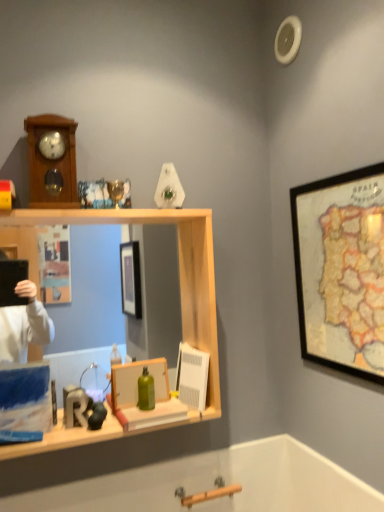
Question: Considering the relative sizes of wooden framed map at upper right, the first picture frame in the top-to-bottom sequence, and wooden clock at upper left in the image provided, is wooden framed map at upper right, the first picture frame in the top-to-bottom sequence, bigger than wooden clock at upper left?

Choices:
 (A) yes
 (B) no

Answer: (A)

Question: From a real-world perspective, is wooden framed map at upper right, placed as the 1th picture frame when sorted from right to left, below wooden clock at upper left?

Choices:
 (A) no
 (B) yes

Answer: (B)

Question: Is wooden framed map at upper right, the second picture frame in the left-to-right sequence, not inside wooden clock at upper left?

Choices:
 (A) yes
 (B) no

Answer: (A)

Question: Is wooden framed map at upper right, placed as the 1th picture frame when sorted from right to left, shorter than wooden clock at upper left?

Choices:
 (A) no
 (B) yes

Answer: (A)

Question: Can you confirm if wooden framed map at upper right, the second picture frame in the left-to-right sequence, is wider than wooden clock at upper left?

Choices:
 (A) no
 (B) yes

Answer: (A)

Question: Is wooden framed map at upper right, placed as the 1th picture frame when sorted from right to left, thinner than wooden clock at upper left?

Choices:
 (A) no
 (B) yes

Answer: (B)

Question: From a real-world perspective, is wooden clock at upper left positioned over wooden shelf at center based on gravity?

Choices:
 (A) no
 (B) yes

Answer: (B)

Question: Is wooden clock at upper left at the right side of wooden shelf at center?

Choices:
 (A) no
 (B) yes

Answer: (A)

Question: Is wooden clock at upper left turned away from wooden shelf at center?

Choices:
 (A) yes
 (B) no

Answer: (B)

Question: Considering the relative positions of wooden clock at upper left and wooden shelf at center in the image provided, is wooden clock at upper left behind wooden shelf at center?

Choices:
 (A) yes
 (B) no

Answer: (A)

Question: Considering the relative sizes of wooden clock at upper left and wooden shelf at center in the image provided, is wooden clock at upper left taller than wooden shelf at center?

Choices:
 (A) yes
 (B) no

Answer: (B)

Question: Is wooden clock at upper left outside of wooden shelf at center?

Choices:
 (A) no
 (B) yes

Answer: (B)

Question: From the image's perspective, does blue matte box at left appear lower than wooden framed map at upper right, placed as the 1th picture frame when sorted from right to left?

Choices:
 (A) no
 (B) yes

Answer: (B)